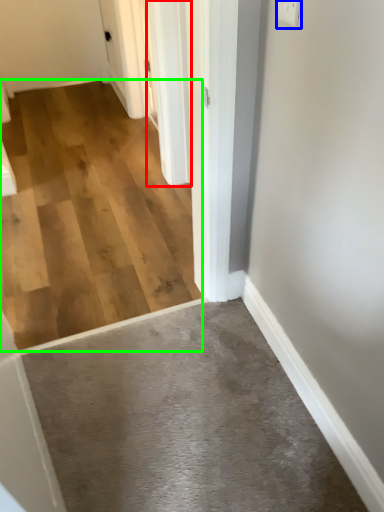
Question: Which object is the closest to the door (highlighted by a red box)? Choose among these: electric outlet (highlighted by a blue box) or concrete (highlighted by a green box).

Choices:
 (A) electric outlet
 (B) concrete

Answer: (B)